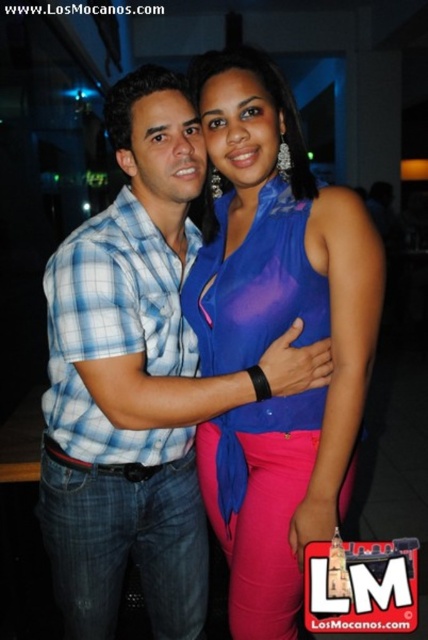
Between blue plaid shirt at center and satin blue blouse at center, which one appears on the right side from the viewer's perspective?

Positioned to the right is satin blue blouse at center.

Which of these two, blue plaid shirt at center or satin blue blouse at center, stands taller?

Standing taller between the two is blue plaid shirt at center.

Which is in front, point (198, 637) or point (303, 161)?

Point (303, 161) is more forward.

Identify the location of blue plaid shirt at center. The image size is (428, 640). (137, 380).